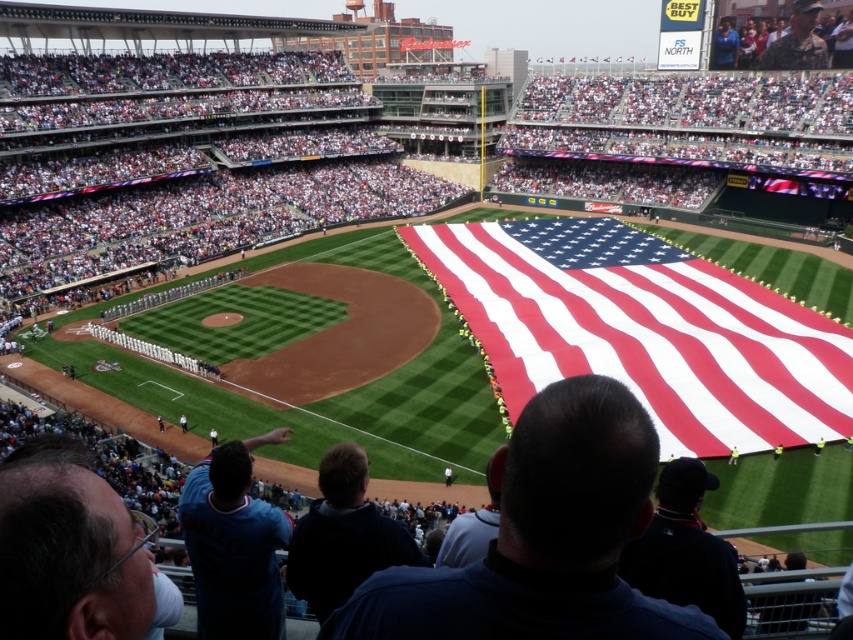
You are a photographer at the baseball stadium and want to capture both the blue jersey at lower left and the yellow fabric at lower right in your photo. Which object should you adjust your camera angle to focus on first if you want to ensure both are in frame?

Since the blue jersey at lower left is shorter than the yellow fabric at lower right, you should first focus on the yellow fabric at lower right to ensure the entire height of both objects fits within the frame.